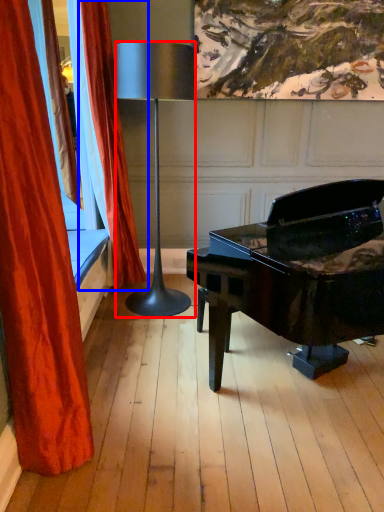
Question: Which object appears farthest to the camera in this image, lamp (highlighted by a red box) or curtain (highlighted by a blue box)?

Choices:
 (A) lamp
 (B) curtain

Answer: (B)